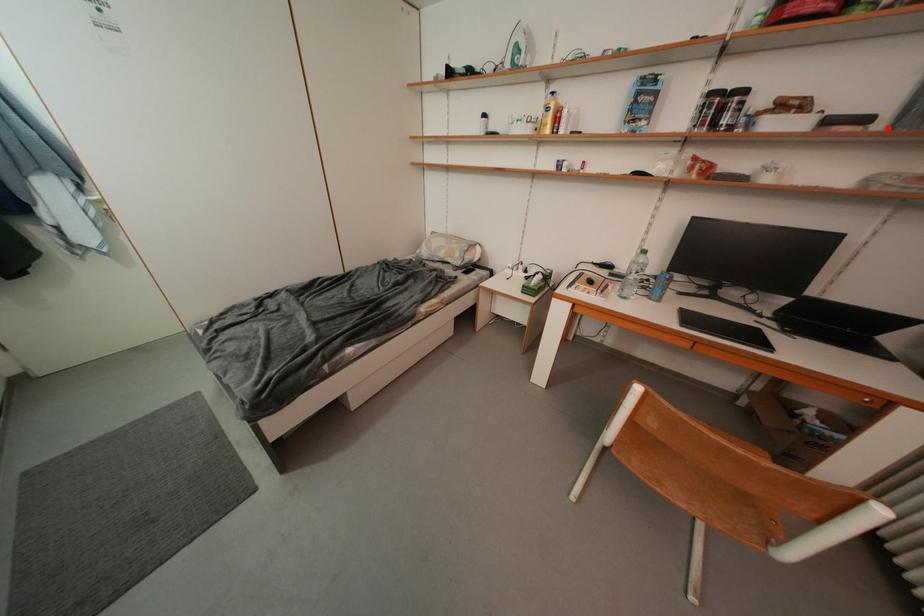
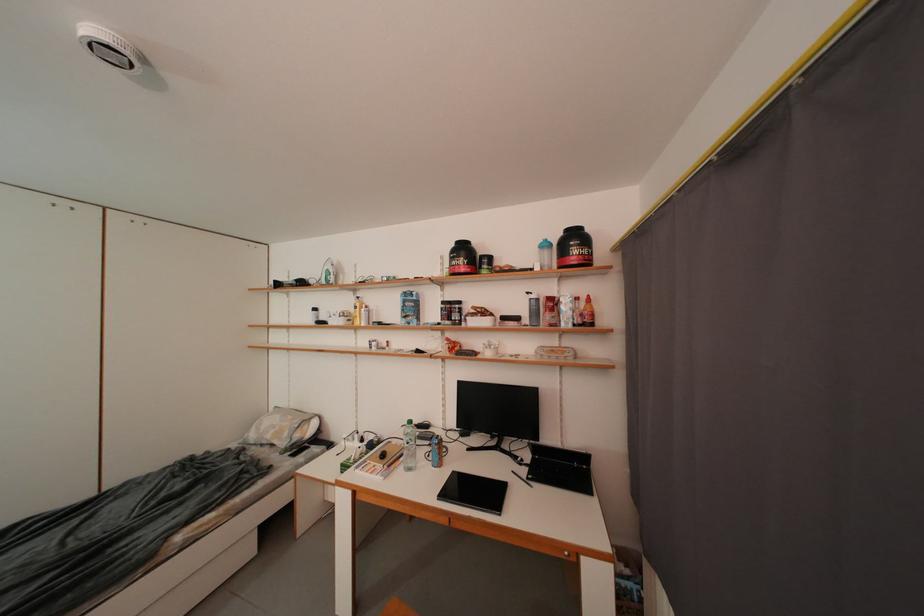
Locate, in the second image, the point that corresponds to the highlighted location in the first image.

(533, 323)